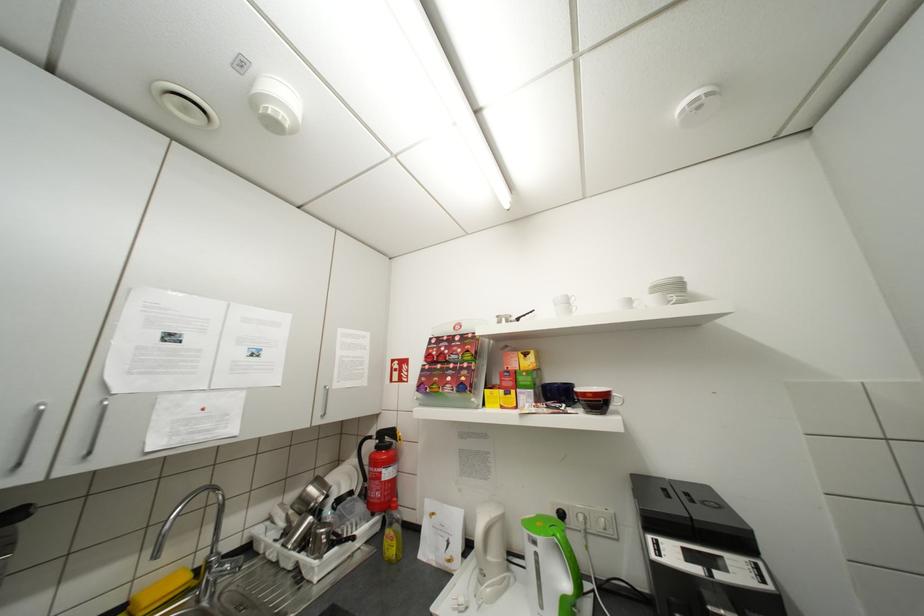
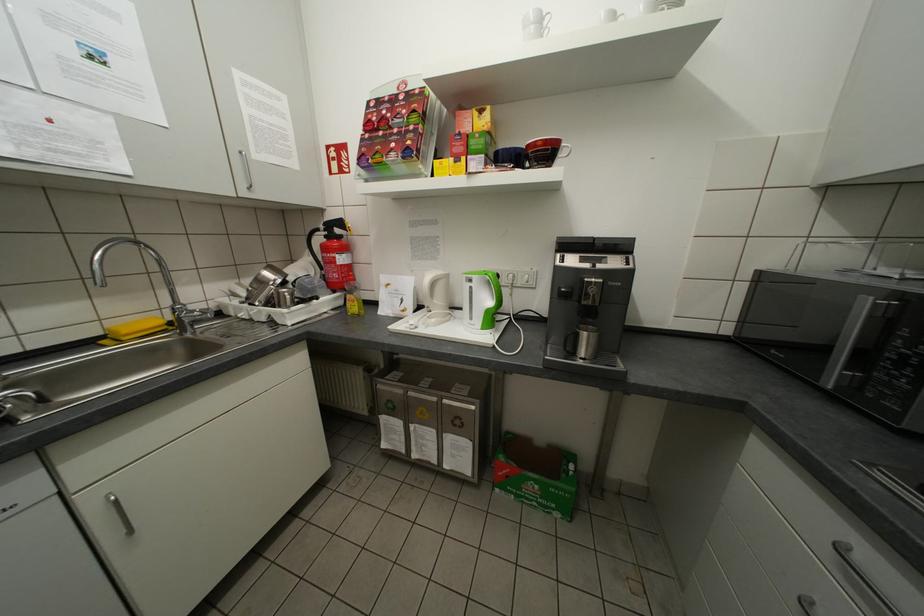
Find the pixel in the second image that matches point (638, 302) in the first image.

(623, 17)